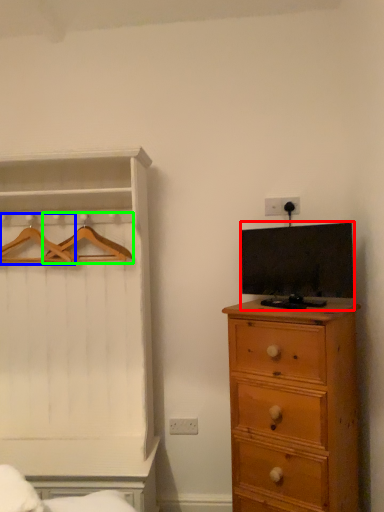
Question: Which object is the closest to the television (highlighted by a red box)? Choose among these: hanger (highlighted by a blue box) or hanger (highlighted by a green box).

Choices:
 (A) hanger
 (B) hanger

Answer: (B)